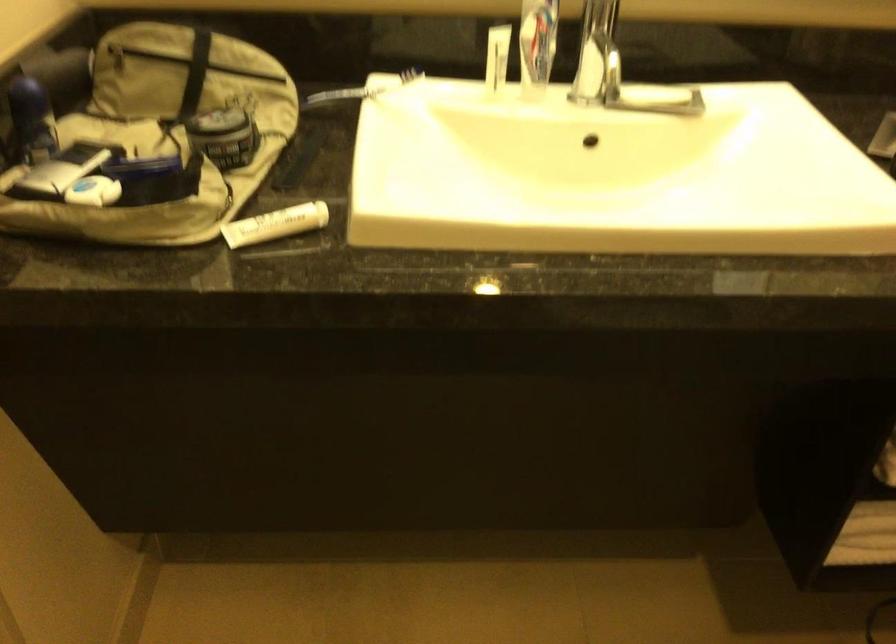
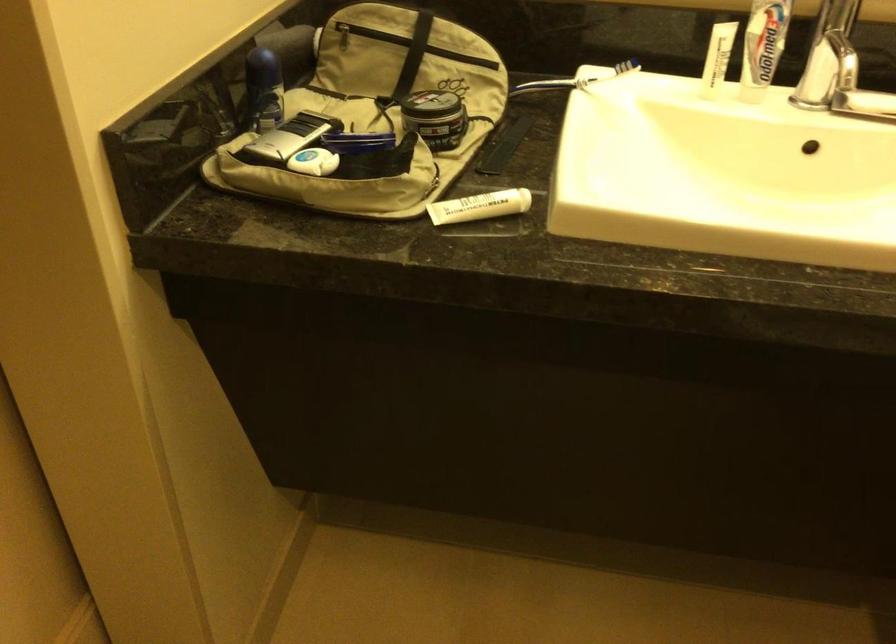
The point at (218, 125) is marked in the first image. Where is the corresponding point in the second image?

(433, 105)